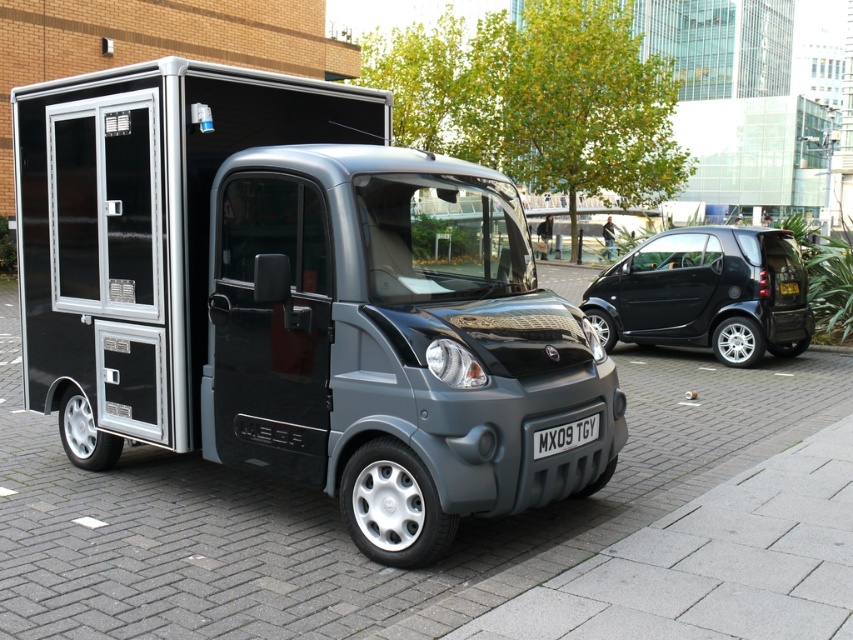
Who is higher up, matte black van at center or shiny black car at right?

shiny black car at right

Is matte black van at center further to camera compared to shiny black car at right?

That is False.

What are the coordinates of `matte black van at center` in the screenshot? It's located at (294, 300).

This screenshot has height=640, width=853. In order to click on matte black van at center in this screenshot , I will do `click(294, 300)`.

Is matte black van at center smaller than white plastic license plate at center?

No.

Between matte black van at center and white plastic license plate at center, which one has more height?

matte black van at center is taller.

Who is more forward, (x=430, y=516) or (x=582, y=417)?

Positioned in front is point (x=430, y=516).

Image resolution: width=853 pixels, height=640 pixels. I want to click on matte black van at center, so click(x=294, y=300).

Can you confirm if shiny black car at right is positioned to the right of white plastic license plate at center?

Yes, shiny black car at right is to the right of white plastic license plate at center.

Is the position of shiny black car at right less distant than that of white plastic license plate at center?

No.

What do you see at coordinates (706, 292) in the screenshot? I see `shiny black car at right` at bounding box center [706, 292].

Find the location of a particular element. The height and width of the screenshot is (640, 853). shiny black car at right is located at coordinates (706, 292).